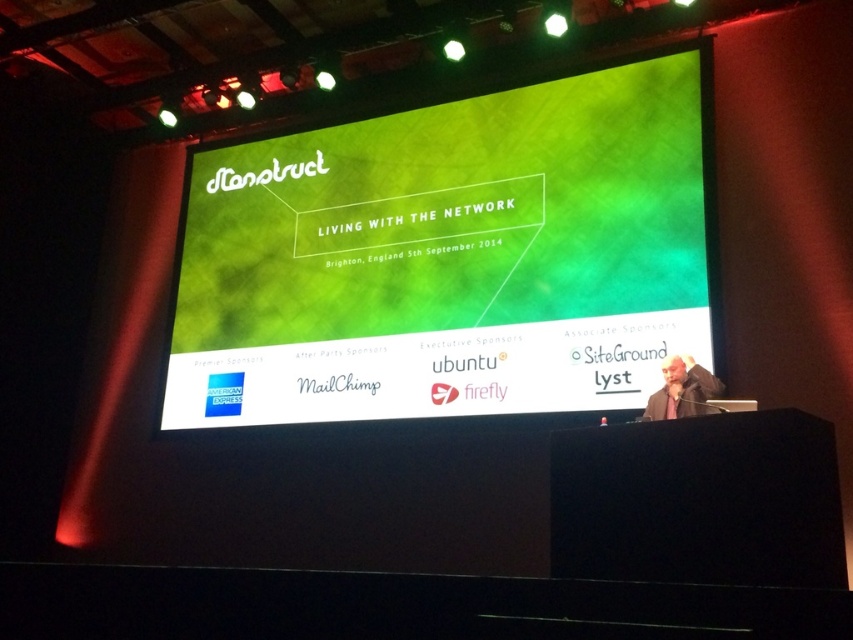
You are an event organizer trying to place a banner on the stage. The banner must be placed exactly at the point with coordinates [453,257]. What object is located at this point?

The point at coordinates [453,257] is where the green matte projection screen at center is located.

You are a photographer setting up for a conference event. You need to position a camera to capture both the green matte projection screen at center and the dark gray jacket at lower right. Based on their sizes, which object should you focus on first to ensure both are in frame?

The green matte projection screen at center might be wider than dark gray jacket at lower right, so you should focus on the green matte projection screen at center first to ensure it fits within the camera frame before adjusting for the smaller dark gray jacket at lower right.